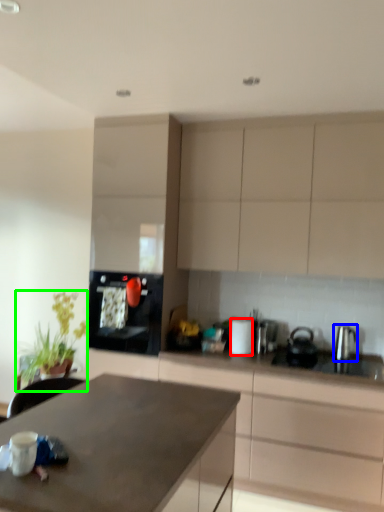
Question: Based on their relative distances, which object is farther from appliance (highlighted by a red box)? Choose from kitchen appliance (highlighted by a blue box) and plant (highlighted by a green box).

Choices:
 (A) kitchen appliance
 (B) plant

Answer: (B)